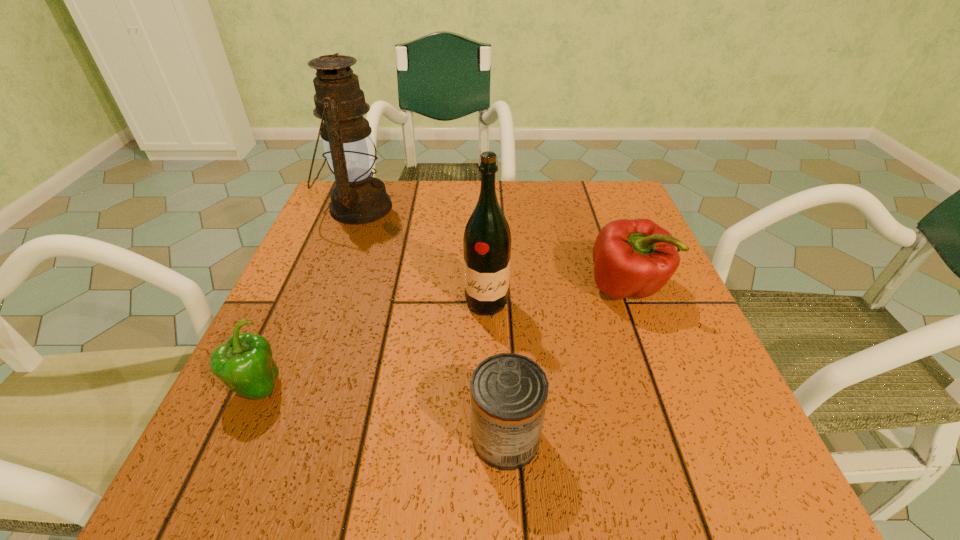
The width and height of the screenshot is (960, 540). I want to click on vacant area located on the back of the can, so click(500, 312).

At what (x,y) coordinates should I click in order to perform the action: click on object that is at the far edge. Please return your answer as a coordinate pair (x, y). Looking at the image, I should click on (357, 197).

At what (x,y) coordinates should I click in order to perform the action: click on object that is at the near edge. Please return your answer as a coordinate pair (x, y). The image size is (960, 540). Looking at the image, I should click on (509, 392).

This screenshot has height=540, width=960. In order to click on oil lamp situated at the left edge in this screenshot , I will do `click(357, 197)`.

This screenshot has height=540, width=960. In order to click on bell pepper at the left edge in this screenshot , I will do `click(244, 364)`.

Find the location of a particular element. This screenshot has height=540, width=960. object that is at the right edge is located at coordinates (637, 257).

At what (x,y) coordinates should I click in order to perform the action: click on object that is positioned at the far left corner. Please return your answer as a coordinate pair (x, y). The width and height of the screenshot is (960, 540). Looking at the image, I should click on (x=357, y=197).

In the image, there is a desktop. Identify the location of vacant region at the far edge. The height and width of the screenshot is (540, 960). (405, 180).

In the image, there is a desktop. Find the location of `blank space at the near edge`. blank space at the near edge is located at coordinates (471, 480).

This screenshot has height=540, width=960. In order to click on free space at the left edge of the desktop in this screenshot , I will do `click(295, 351)`.